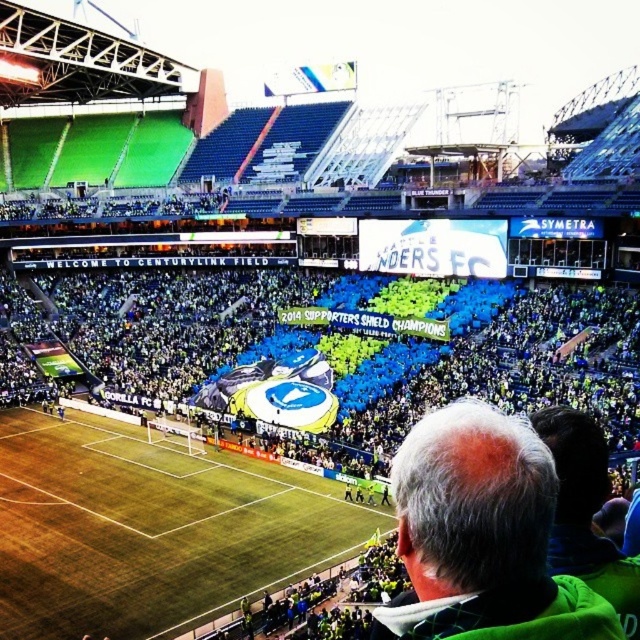
Question: Is green grass football field at center to the left of green fabric at lower right from the viewer's perspective?

Choices:
 (A) yes
 (B) no

Answer: (A)

Question: Estimate the real-world distances between objects in this image. Which object is closer to the gray hair at upper center?

Choices:
 (A) green fabric at lower right
 (B) green grass football field at center

Answer: (A)

Question: Can you confirm if green grass football field at center is wider than gray hair at upper center?

Choices:
 (A) no
 (B) yes

Answer: (B)

Question: Which point is farther to the camera?

Choices:
 (A) (580, 477)
 (B) (564, 481)

Answer: (A)

Question: Which point is farther to the camera?

Choices:
 (A) green fabric at lower right
 (B) green grass football field at center

Answer: (B)

Question: Can you confirm if green grass football field at center is bigger than green fabric at lower right?

Choices:
 (A) no
 (B) yes

Answer: (B)